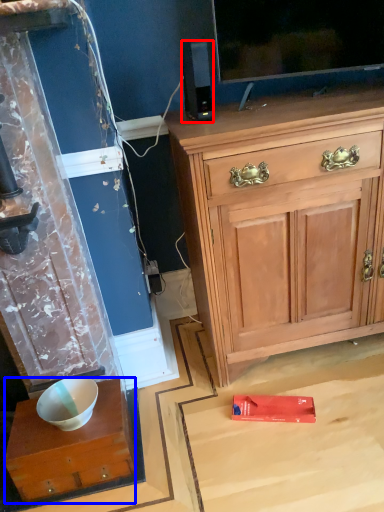
Question: Which object is further to the camera taking this photo, loudspeaker (highlighted by a red box) or desk (highlighted by a blue box)?

Choices:
 (A) loudspeaker
 (B) desk

Answer: (A)